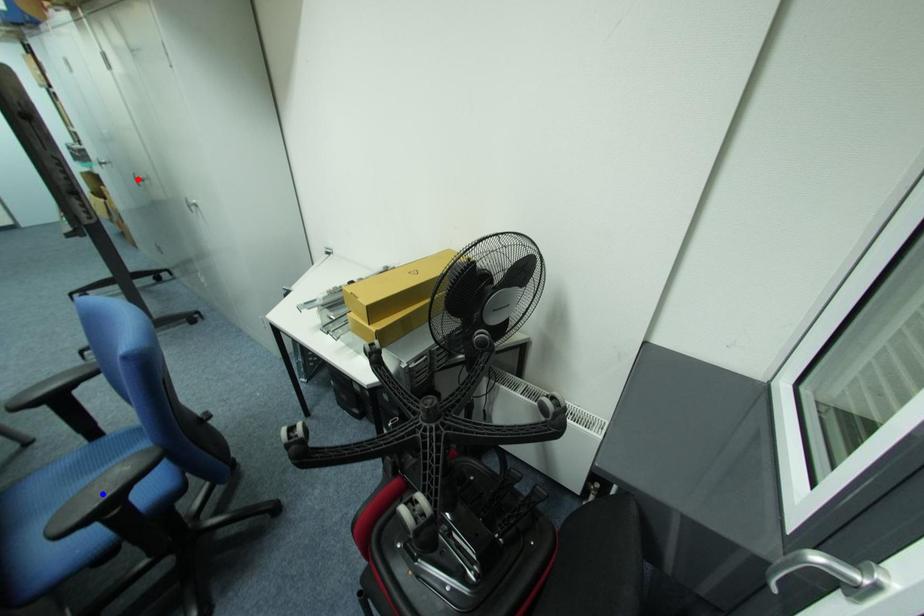
Question: In the image, two points are highlighted. Which point is nearer to the camera? Reply with the corresponding letter.

Choices:
 (A) blue point
 (B) red point

Answer: (A)